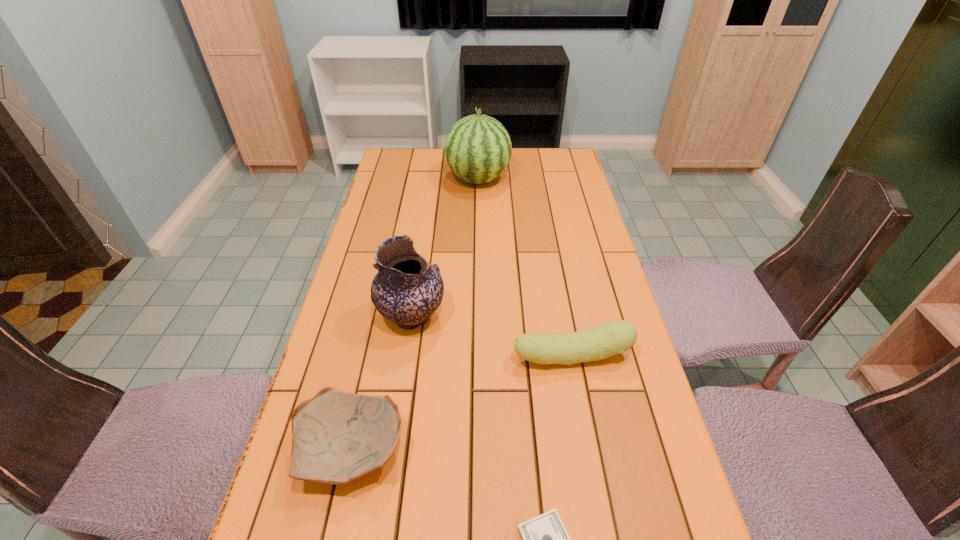
At what (x,y) coordinates should I click in order to perform the action: click on watermelon. Please return your answer as a coordinate pair (x, y). This screenshot has height=540, width=960. Looking at the image, I should click on (478, 148).

I want to click on the farthest object, so coord(478,148).

The height and width of the screenshot is (540, 960). I want to click on the second tallest object, so click(407, 290).

The image size is (960, 540). Identify the location of the farther pottery. (407, 290).

In order to click on cucumber in this screenshot , I will do `click(617, 336)`.

This screenshot has height=540, width=960. In order to click on the second nearest object in this screenshot , I will do `click(337, 437)`.

Where is `the shorter pottery`? the shorter pottery is located at coordinates (337, 437).

You are a GUI agent. You are given a task and a screenshot of the screen. Output one action in this format:
    pyautogui.click(x=<x>, y=<y>)
    Task: Click on the blank space located on the left of the watermelon
    
    Given the screenshot: What is the action you would take?
    pyautogui.click(x=394, y=179)

The width and height of the screenshot is (960, 540). I want to click on vacant area located 0.330m on the front of the farther pottery, so click(388, 478).

The height and width of the screenshot is (540, 960). Identify the location of free space located 0.140m on the front of the cucumber. (584, 429).